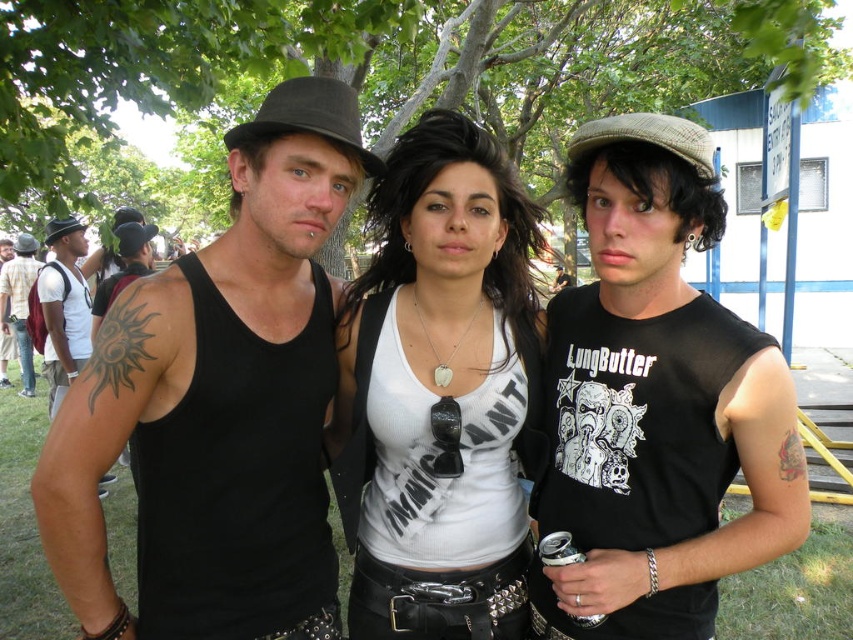
You are a photographer at the festival trying to frame both the black matte tank top at center and the black matte tank top at left in your shot. Which tank top appears larger in the photo?

The black matte tank top at left appears larger in the photo because it is physically larger than the black matte tank top at center.

You are a photographer trying to capture the black mesh tank top at center and the matte black tank top at left. Which one is closer to the camera?

The black mesh tank top at center is positioned under the matte black tank top at left, so the matte black tank top at left is closer to the camera.